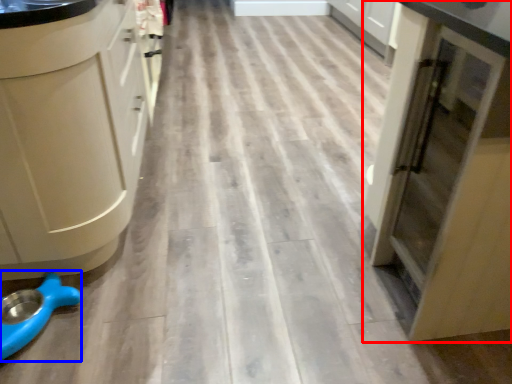
Question: Which object appears closest to the camera in this image, cupboard (highlighted by a red box) or appliance (highlighted by a blue box)?

Choices:
 (A) cupboard
 (B) appliance

Answer: (A)